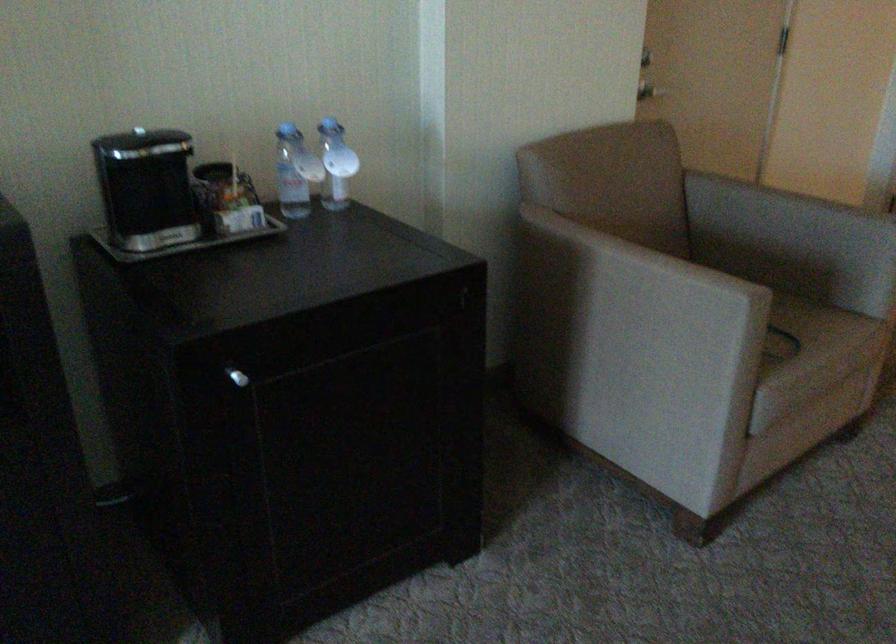
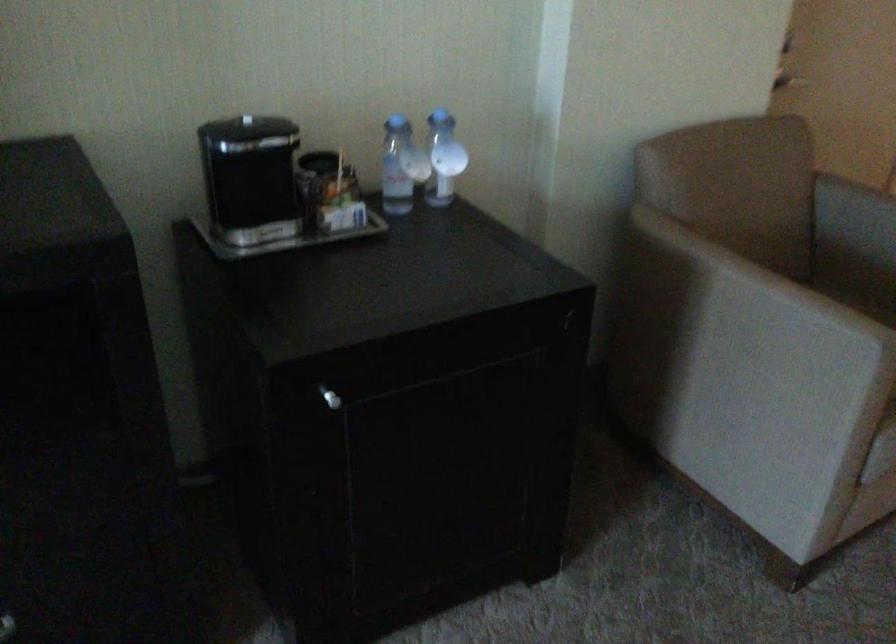
In the second image, find the point that corresponds to pixel 624 292 in the first image.

(739, 319)